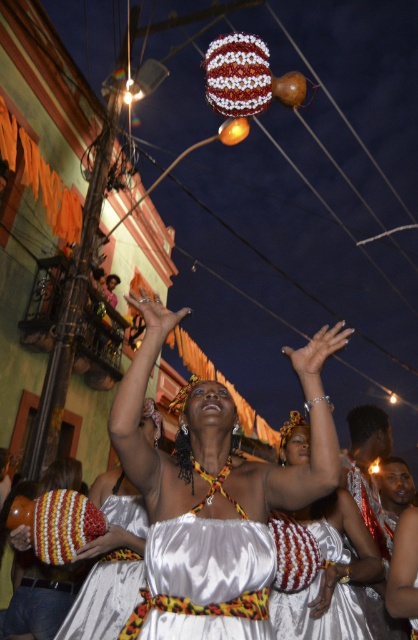
Question: Observing the image, what is the correct spatial positioning of white satin dress at center in reference to knitted fabric dress at center?

Choices:
 (A) right
 (B) left

Answer: (A)

Question: Does satin white dress at center have a greater width compared to white satin dress at center?

Choices:
 (A) yes
 (B) no

Answer: (A)

Question: Which point is closer to the camera taking this photo?

Choices:
 (A) (142, 508)
 (B) (343, 605)

Answer: (B)

Question: Which object is positioned farthest from the satin white dress at center?

Choices:
 (A) knitted fabric dress at center
 (B) white satin dress at center

Answer: (A)

Question: Among these objects, which one is farthest from the camera?

Choices:
 (A) knitted fabric dress at center
 (B) white satin dress at center

Answer: (A)

Question: Is satin white dress at center below white satin dress at center?

Choices:
 (A) yes
 (B) no

Answer: (B)